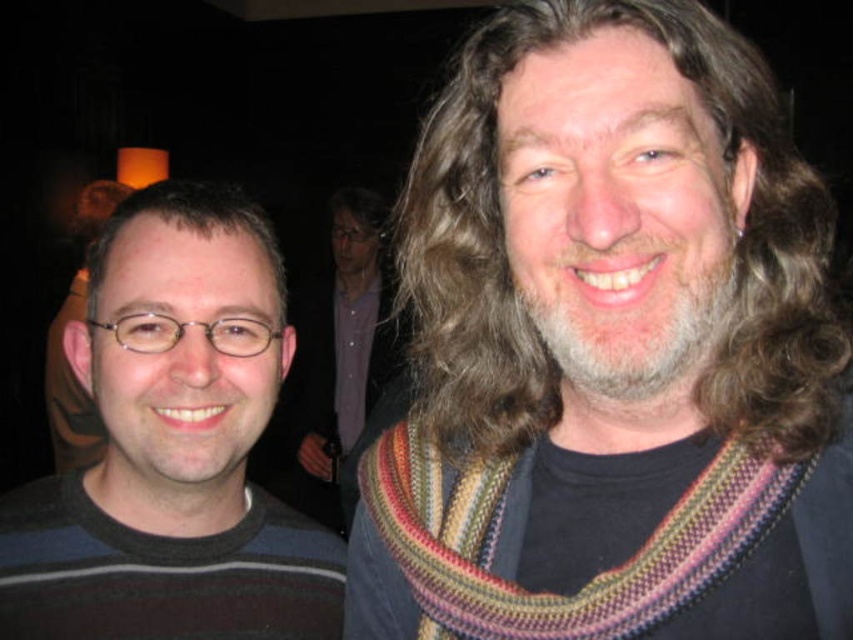
Question: Which of the following is the closest to the observer?

Choices:
 (A) knitted multicolored scarf at right
 (B) striped sweater at left

Answer: (A)

Question: Among these objects, which one is farthest from the camera?

Choices:
 (A) knitted scarf at center
 (B) knitted multicolored scarf at right
 (C) brown wavy hair at right
 (D) striped sweater at left

Answer: (A)

Question: Does striped sweater at left come in front of brown wavy hair at right?

Choices:
 (A) no
 (B) yes

Answer: (A)

Question: Considering the relative positions of striped sweater at left and knitted scarf at center in the image provided, where is striped sweater at left located with respect to knitted scarf at center?

Choices:
 (A) below
 (B) above

Answer: (B)

Question: Does striped sweater at left appear on the right side of knitted scarf at center?

Choices:
 (A) no
 (B) yes

Answer: (B)

Question: Considering the real-world distances, which object is closest to the dark brown hair at left?

Choices:
 (A) knitted scarf at center
 (B) striped sweater at left
 (C) brown wavy hair at right

Answer: (B)